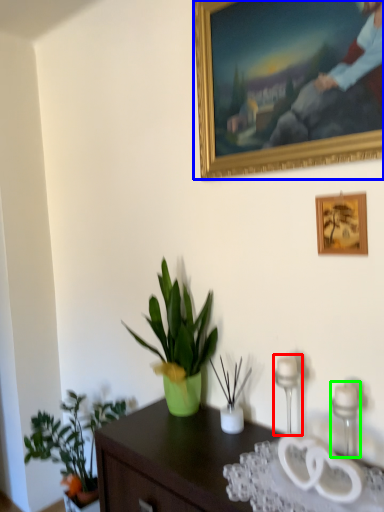
Question: Which object is positioned closest to candle holder (highlighted by a red box)? Select from picture frame (highlighted by a blue box) and candle holder (highlighted by a green box).

Choices:
 (A) picture frame
 (B) candle holder

Answer: (B)